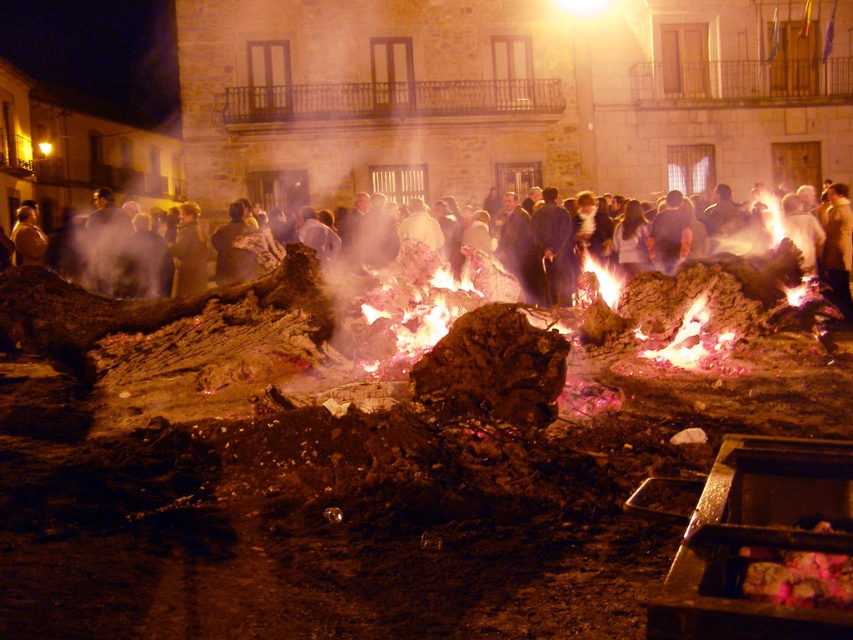
You are attending a festival and notice a white cotton dress at center and a charred wood at center in the scene. Which object is shorter?

The white cotton dress at center is shorter than the charred wood at center.

You are at a festival and want to place a small lantern on the charcoal ash fire pit at lower right. Considering the height of the white cotton dress at center, will the lantern be visible from above the dress?

The charcoal ash fire pit at lower right has a lesser height compared to the white cotton dress at center, so the lantern placed on the charcoal ash fire pit at lower right will not be visible from above the dress.